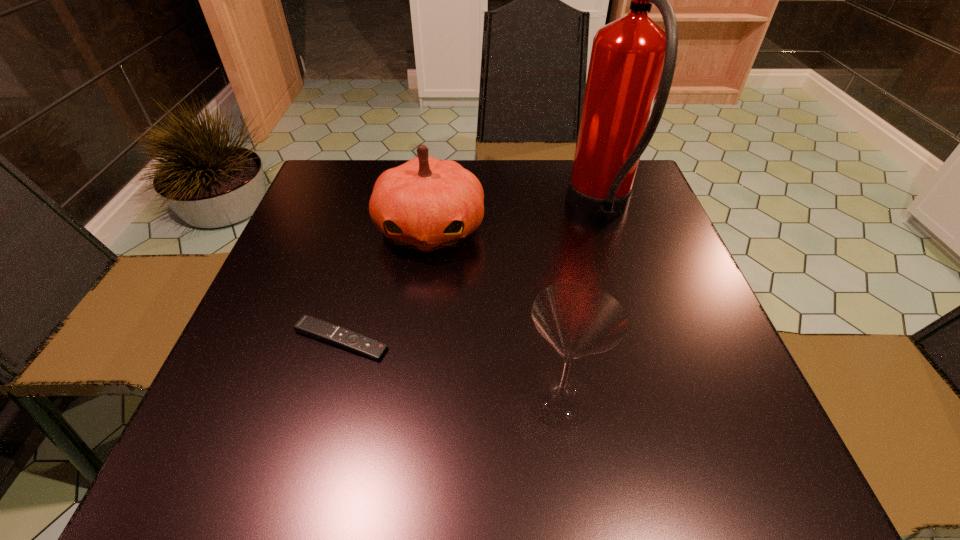
Image resolution: width=960 pixels, height=540 pixels. Find the location of `the tallest object`. the tallest object is located at coordinates (633, 59).

Locate an element on the screen. the rightmost object is located at coordinates (633, 59).

The height and width of the screenshot is (540, 960). Identify the location of pumpkin. (426, 204).

This screenshot has height=540, width=960. What are the coordinates of `flute glass` in the screenshot? It's located at (578, 319).

I want to click on the nearest object, so [578, 319].

Where is `remote control`? Image resolution: width=960 pixels, height=540 pixels. remote control is located at coordinates (316, 328).

This screenshot has height=540, width=960. What are the coordinates of `the shortest object` in the screenshot? It's located at (316, 328).

Where is `free space located on the front of the rightmost object`? This screenshot has width=960, height=540. free space located on the front of the rightmost object is located at coordinates (622, 277).

Where is `vacant region located on the front-facing side of the pumpkin`? Image resolution: width=960 pixels, height=540 pixels. vacant region located on the front-facing side of the pumpkin is located at coordinates (412, 377).

Locate an element on the screen. vacant area located 0.170m on the left of the flute glass is located at coordinates (419, 399).